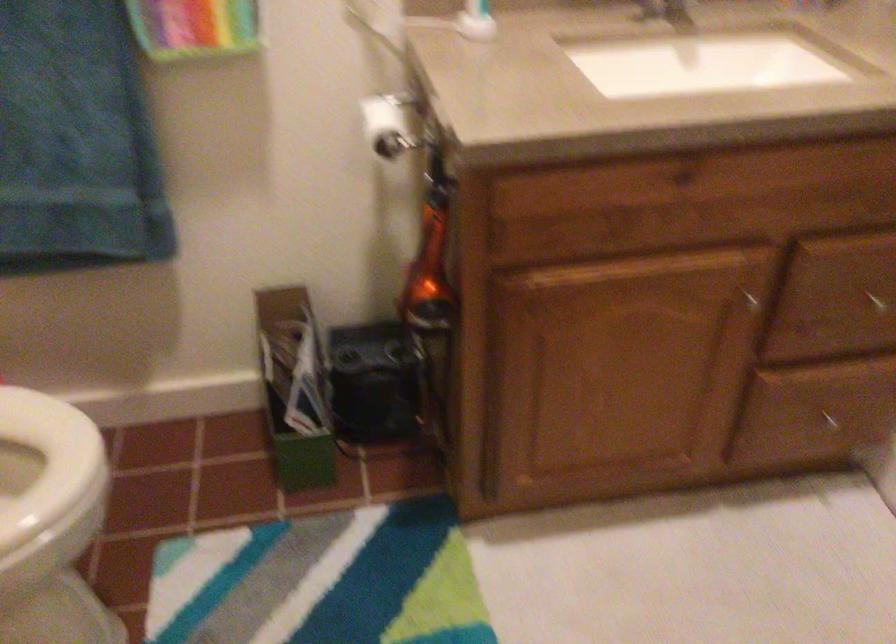
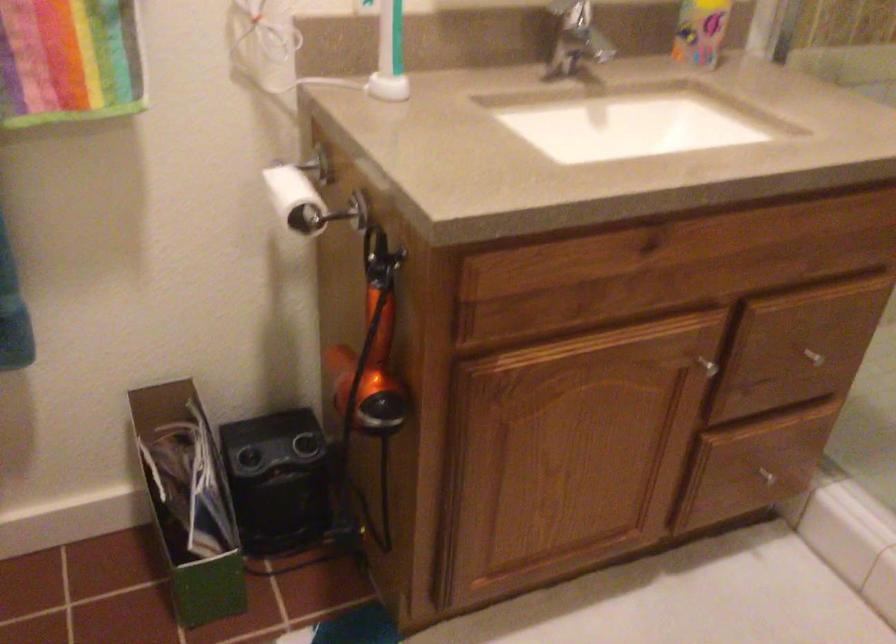
Question: The images are taken continuously from a first-person perspective. In which direction is your viewpoint rotating?

Choices:
 (A) Left
 (B) Right
 (C) Up
 (D) Down

Answer: (B)